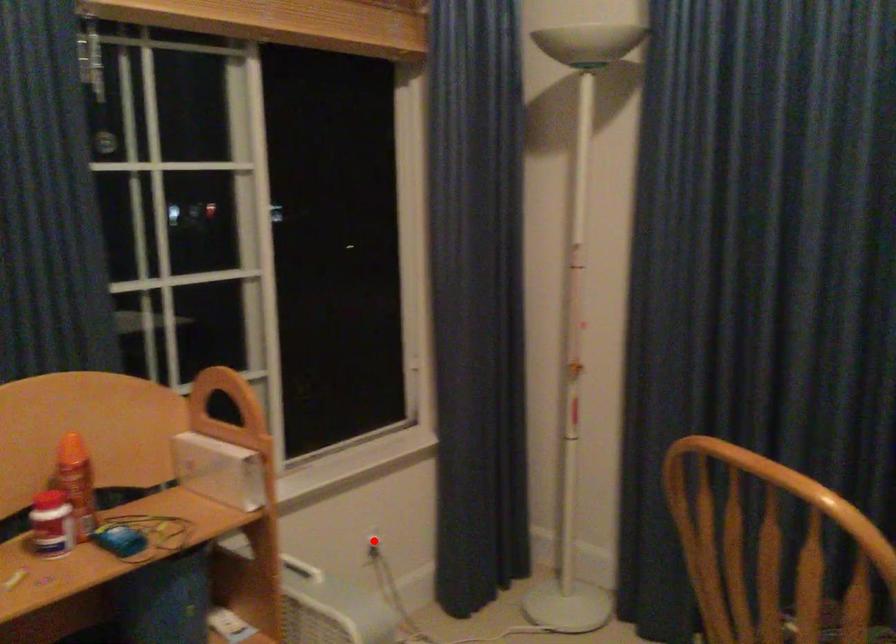
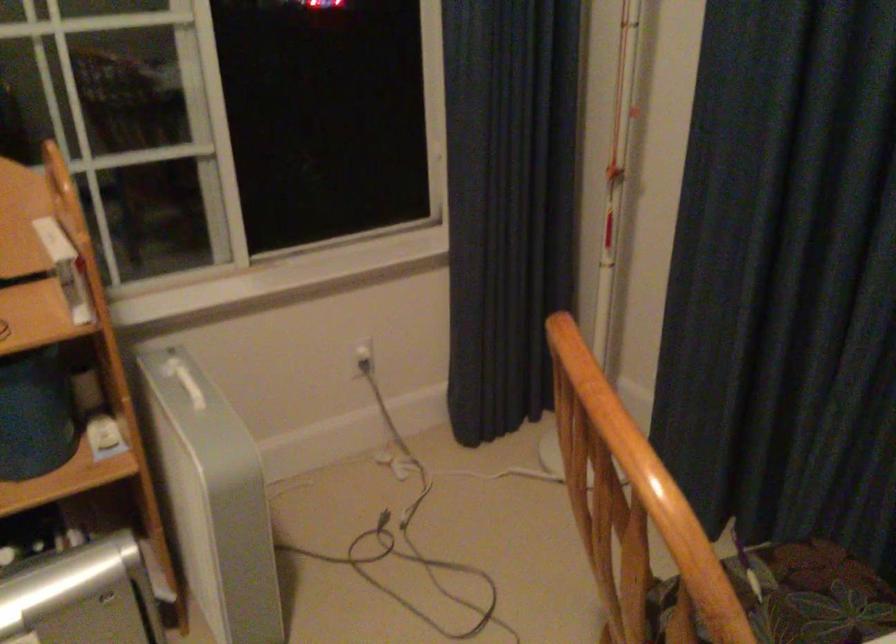
In the second image, find the point that corresponds to the highlighted location in the first image.

(363, 355)